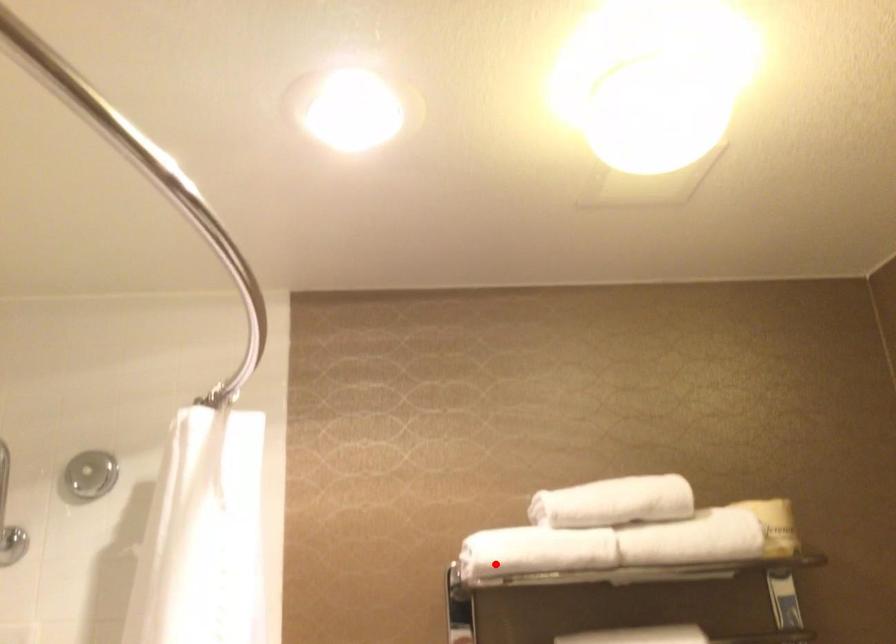
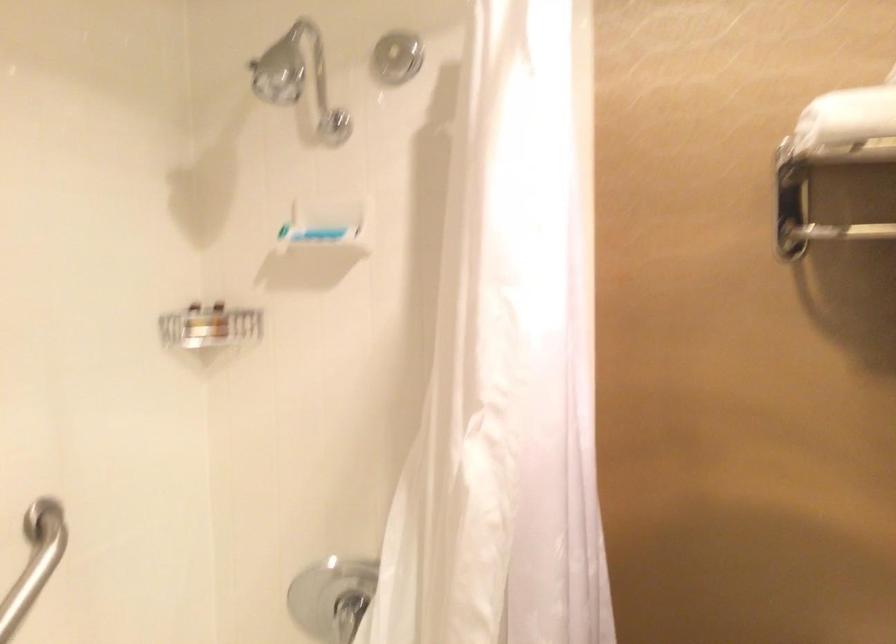
The point at the highlighted location is marked in the first image. Where is the corresponding point in the second image?

(846, 118)